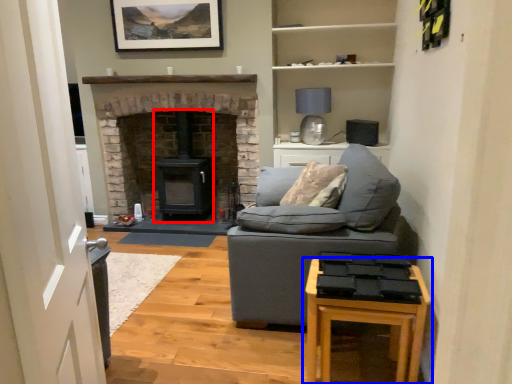
Question: Which object appears closest to the camera in this image, wood burning stove (highlighted by a red box) or table (highlighted by a blue box)?

Choices:
 (A) wood burning stove
 (B) table

Answer: (B)